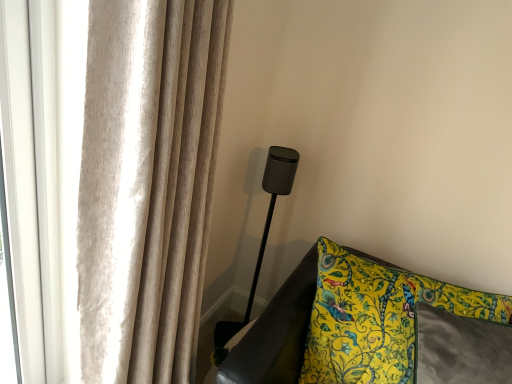
Describe the element at coordinates (273, 200) in the screenshot. I see `matte black speaker at center` at that location.

Where is `yellow floral fabric cushion at lower right`? The height and width of the screenshot is (384, 512). yellow floral fabric cushion at lower right is located at coordinates (364, 330).

Identify the location of matte black speaker at center. (273, 200).

Is beige textured curtain at upper left touching yellow floral fabric cushion at lower right?

No, beige textured curtain at upper left is not in contact with yellow floral fabric cushion at lower right.

In the scene shown: Considering the sizes of beige textured curtain at upper left and yellow floral fabric cushion at lower right in the image, is beige textured curtain at upper left taller or shorter than yellow floral fabric cushion at lower right?

beige textured curtain at upper left is taller than yellow floral fabric cushion at lower right.

Can you tell me how much beige textured curtain at upper left and yellow floral fabric cushion at lower right differ in facing direction?

The facing directions of beige textured curtain at upper left and yellow floral fabric cushion at lower right are 64.8 degrees apart.

Can you confirm if beige textured curtain at upper left is wider than yellow floral fabric cushion at lower right?

Yes, beige textured curtain at upper left is wider than yellow floral fabric cushion at lower right.

Is matte black speaker at center wider than beige textured curtain at upper left?

Incorrect, the width of matte black speaker at center does not surpass that of beige textured curtain at upper left.

The image size is (512, 384). What are the coordinates of `table lamp located behind the beige textured curtain at upper left` in the screenshot? It's located at pyautogui.click(x=273, y=200).

Between matte black speaker at center and beige textured curtain at upper left, which one has smaller size?

matte black speaker at center is smaller.

Is matte black speaker at center shorter than beige textured curtain at upper left?

Correct, matte black speaker at center is not as tall as beige textured curtain at upper left.

Which object is positioned more to the left, matte black speaker at center or yellow floral fabric cushion at lower right?

Positioned to the left is matte black speaker at center.

From a real-world perspective, is matte black speaker at center located beneath yellow floral fabric cushion at lower right?

No, from a real-world perspective, matte black speaker at center is not below yellow floral fabric cushion at lower right.

Which is farther from the camera, [272,210] or [457,320]?

The point [272,210] is more distant.

Find the location of a particular element. The width and height of the screenshot is (512, 384). table lamp that is above the yellow floral fabric cushion at lower right (from the image's perspective) is located at coordinates (273, 200).

From the image's perspective, is yellow floral fabric cushion at lower right on matte black speaker at center?

Actually, yellow floral fabric cushion at lower right appears below matte black speaker at center in the image.

Does yellow floral fabric cushion at lower right turn towards matte black speaker at center?

No, yellow floral fabric cushion at lower right is not facing towards matte black speaker at center.

Is yellow floral fabric cushion at lower right behind matte black speaker at center?

No.

Considering the points (432, 380) and (264, 251), which point is behind, point (432, 380) or point (264, 251)?

The point (264, 251) is more distant.

Is beige textured curtain at upper left facing away from matte black speaker at center?

beige textured curtain at upper left is not turned away from matte black speaker at center.

Is beige textured curtain at upper left closer to camera compared to matte black speaker at center?

That is True.

From the image's perspective, does beige textured curtain at upper left appear lower than matte black speaker at center?

Yes.

From a real-world perspective, which is physically below, beige textured curtain at upper left or matte black speaker at center?

matte black speaker at center is physically lower.

Considering the positions of point (368, 282) and point (169, 230), is point (368, 282) closer or farther from the camera than point (169, 230)?

Point (368, 282) is positioned farther from the camera compared to point (169, 230).

Is yellow floral fabric cushion at lower right next to beige textured curtain at upper left?

They are not placed beside each other.

From the image's perspective, who appears lower, yellow floral fabric cushion at lower right or beige textured curtain at upper left?

From the image's view, yellow floral fabric cushion at lower right is below.

Where is `curtain located in front of the yellow floral fabric cushion at lower right`? This screenshot has width=512, height=384. curtain located in front of the yellow floral fabric cushion at lower right is located at coordinates (147, 184).

You are a GUI agent. You are given a task and a screenshot of the screen. Output one action in this format:
    pyautogui.click(x=<x>, y=<y>)
    Task: Click on the table lamp behind the beige textured curtain at upper left
    This screenshot has height=384, width=512.
    Given the screenshot: What is the action you would take?
    pyautogui.click(x=273, y=200)

When comparing their distances from yellow floral fabric cushion at lower right, does matte black speaker at center or beige textured curtain at upper left seem closer?

The object closer to yellow floral fabric cushion at lower right is matte black speaker at center.

Which object lies nearer to the anchor point beige textured curtain at upper left, yellow floral fabric cushion at lower right or matte black speaker at center?

yellow floral fabric cushion at lower right.

Consider the image. Which object lies further to the anchor point matte black speaker at center, beige textured curtain at upper left or yellow floral fabric cushion at lower right?

The object further to matte black speaker at center is beige textured curtain at upper left.

Consider the image. From the image, which object appears to be farther from yellow floral fabric cushion at lower right, beige textured curtain at upper left or matte black speaker at center?

Among the two, beige textured curtain at upper left is located further to yellow floral fabric cushion at lower right.

Which object lies further to the anchor point matte black speaker at center, yellow floral fabric cushion at lower right or beige textured curtain at upper left?

beige textured curtain at upper left.

When comparing their distances from beige textured curtain at upper left, does matte black speaker at center or yellow floral fabric cushion at lower right seem further?

Among the two, matte black speaker at center is located further to beige textured curtain at upper left.

Identify the location of furniture between beige textured curtain at upper left and matte black speaker at center along the z-axis. (364, 330).